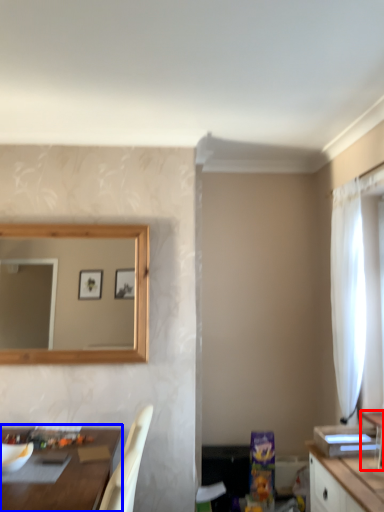
Question: Which object is further to the camera taking this photo, vanity (highlighted by a red box) or table (highlighted by a blue box)?

Choices:
 (A) vanity
 (B) table

Answer: (A)